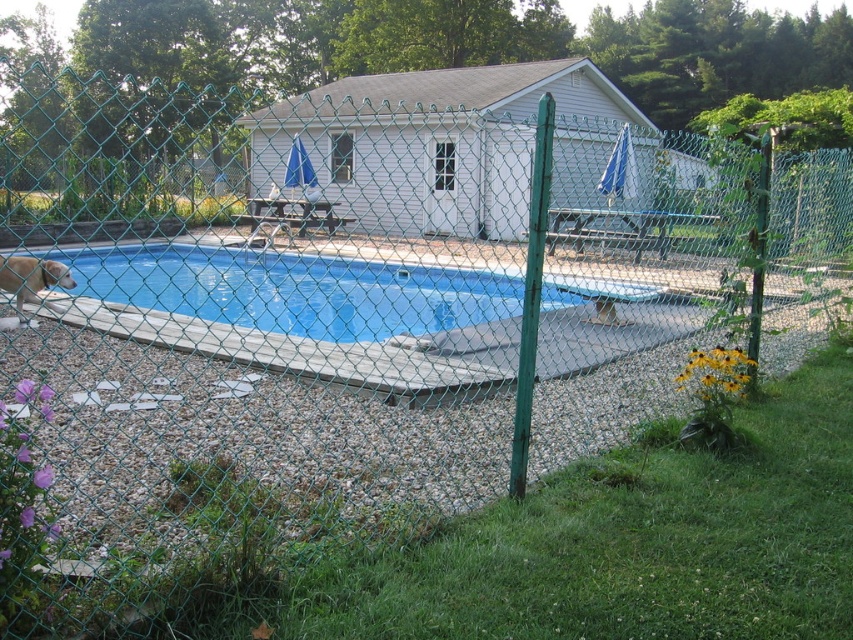
Question: Is blue vinyl liner at left positioned behind light brown fur at lower left?

Choices:
 (A) no
 (B) yes

Answer: (B)

Question: Which object is farther from the camera taking this photo?

Choices:
 (A) light brown fur at lower left
 (B) blue vinyl liner at left

Answer: (B)

Question: Is blue vinyl liner at left below light brown fur at lower left?

Choices:
 (A) yes
 (B) no

Answer: (B)

Question: Among these objects, which one is nearest to the camera?

Choices:
 (A) light brown fur at lower left
 (B) blue vinyl liner at left

Answer: (A)

Question: Can you confirm if blue vinyl liner at left is positioned above light brown fur at lower left?

Choices:
 (A) no
 (B) yes

Answer: (B)